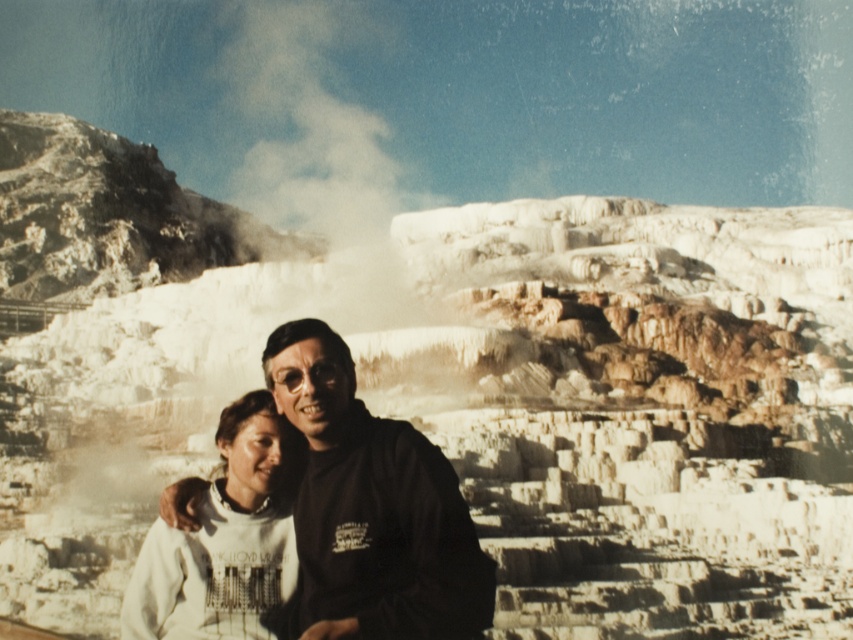
Can you confirm if white matte sweatshirt at center is positioned to the right of white fleece sweatshirt at center?

Indeed, white matte sweatshirt at center is positioned on the right side of white fleece sweatshirt at center.

Where is `white matte sweatshirt at center`? white matte sweatshirt at center is located at coordinates (372, 508).